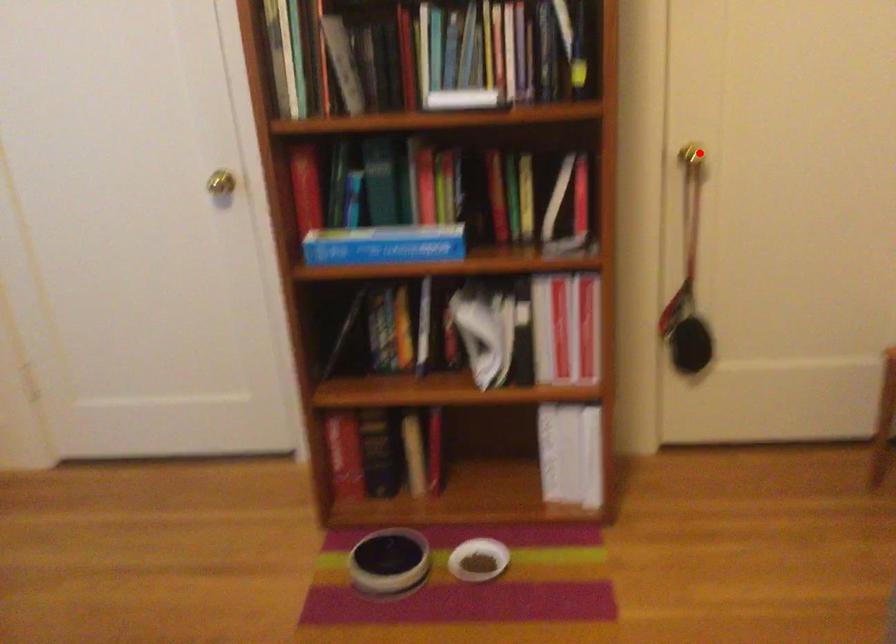
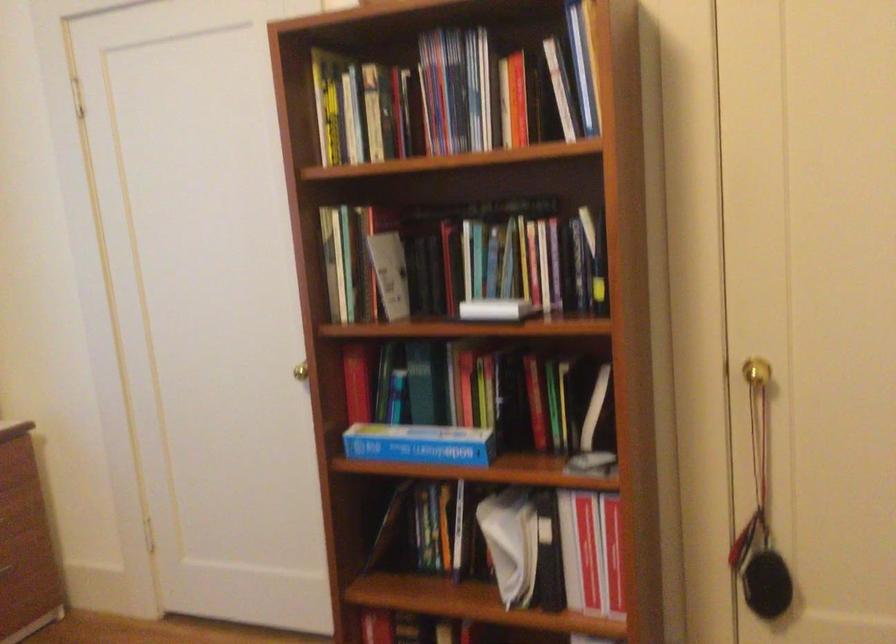
Question: I am providing you with two images of the same scene from different viewpoints. A red point is shown in image1. For the corresponding object point in image2, is it positioned nearer or farther from the camera?

Choices:
 (A) Nearer
 (B) Farther

Answer: (A)